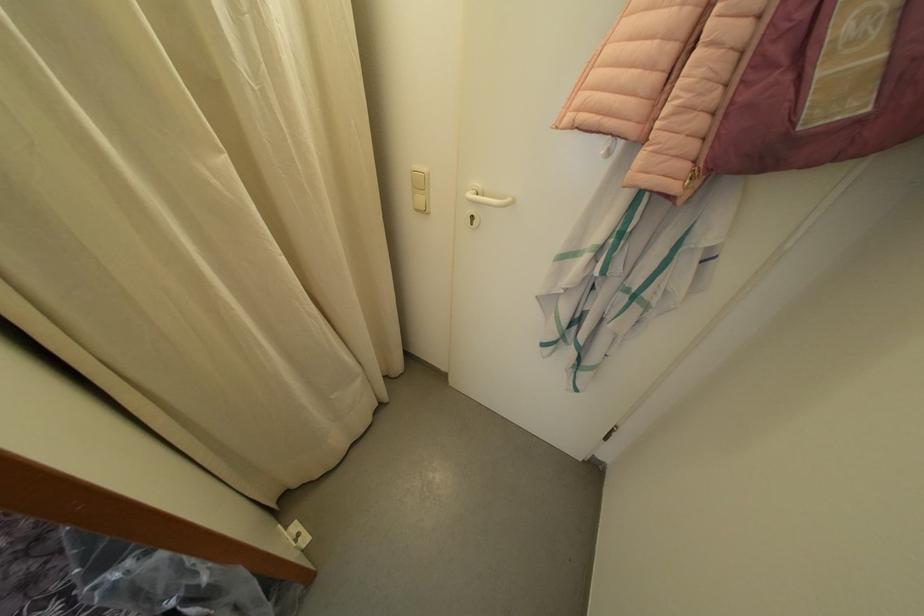
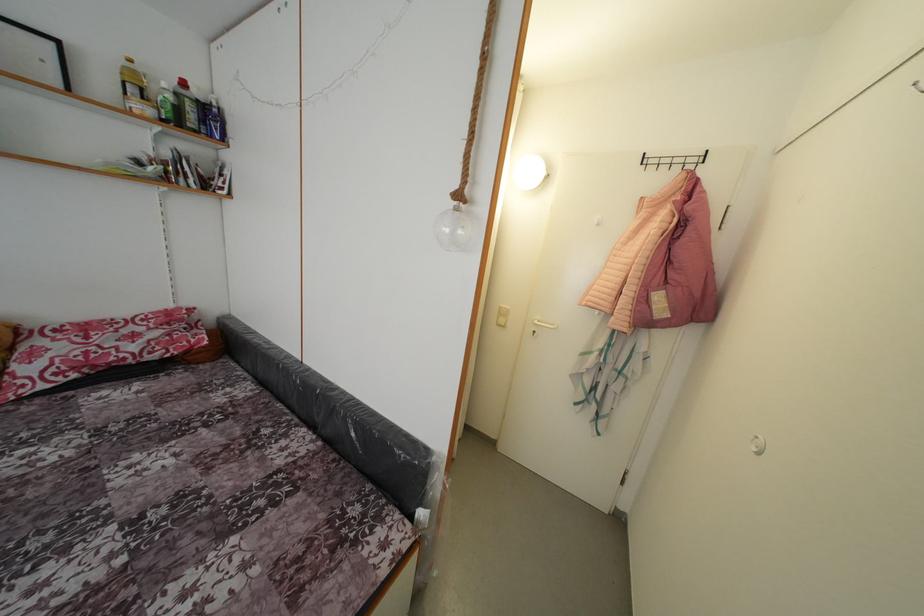
Question: Based on the continuous images, in which direction is the camera rotating? Reply with the corresponding letter.

Choices:
 (A) Left
 (B) Right
 (C) Up
 (D) Down

Answer: (C)